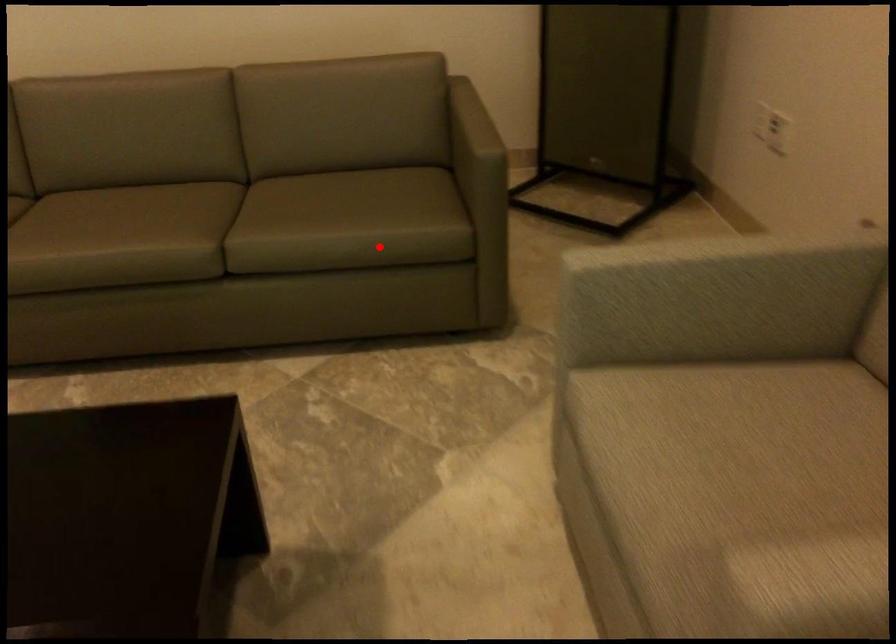
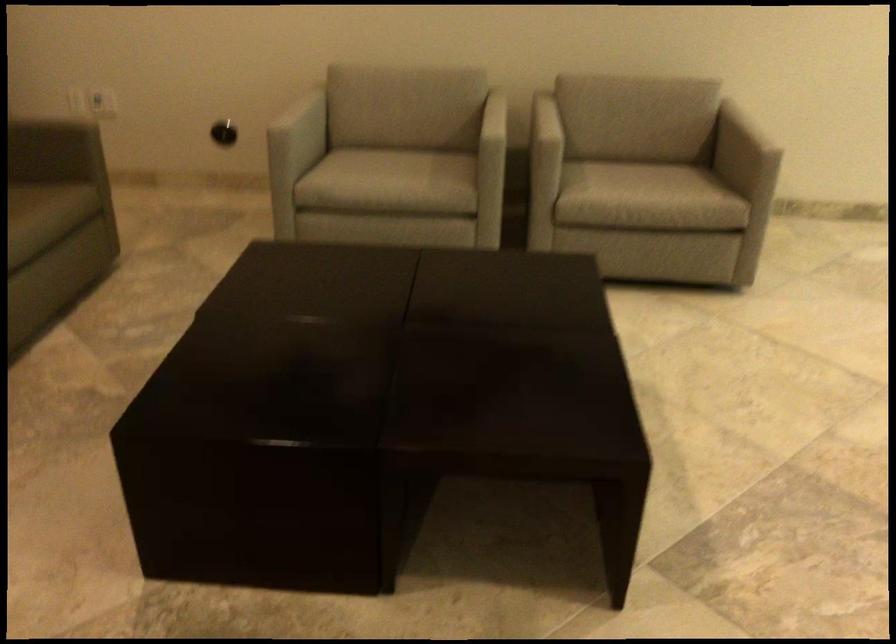
Find the pixel in the second image that matches the highlighted location in the first image.

(36, 219)